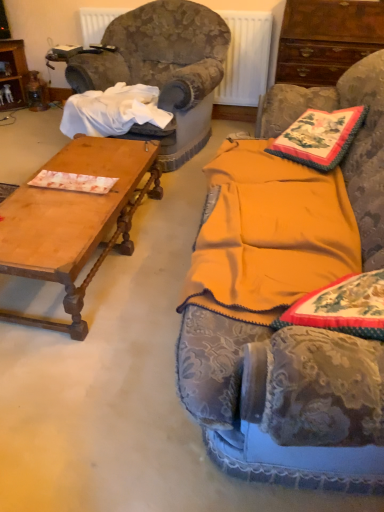
Question: Can you confirm if mahogany wood cabinet at upper right is taller than wooden polished coffee table at left?

Choices:
 (A) no
 (B) yes

Answer: (B)

Question: From a real-world perspective, is mahogany wood cabinet at upper right over wooden polished coffee table at left?

Choices:
 (A) no
 (B) yes

Answer: (B)

Question: Is mahogany wood cabinet at upper right shorter than wooden polished coffee table at left?

Choices:
 (A) no
 (B) yes

Answer: (A)

Question: Can we say mahogany wood cabinet at upper right lies outside wooden polished coffee table at left?

Choices:
 (A) yes
 (B) no

Answer: (A)

Question: Is mahogany wood cabinet at upper right positioned before wooden polished coffee table at left?

Choices:
 (A) yes
 (B) no

Answer: (B)

Question: Can you confirm if mahogany wood cabinet at upper right is positioned to the right of wooden polished coffee table at left?

Choices:
 (A) yes
 (B) no

Answer: (A)

Question: Is velvet fabric couch at center wider than wooden polished coffee table at left?

Choices:
 (A) yes
 (B) no

Answer: (A)

Question: Is velvet fabric couch at center not near wooden polished coffee table at left?

Choices:
 (A) no
 (B) yes

Answer: (B)

Question: Is velvet fabric couch at center aimed at wooden polished coffee table at left?

Choices:
 (A) yes
 (B) no

Answer: (A)

Question: From a real-world perspective, is velvet fabric couch at center on top of wooden polished coffee table at left?

Choices:
 (A) no
 (B) yes

Answer: (B)

Question: From the image's perspective, is velvet fabric couch at center located beneath wooden polished coffee table at left?

Choices:
 (A) no
 (B) yes

Answer: (A)

Question: Does velvet fabric couch at center have a smaller size compared to wooden polished coffee table at left?

Choices:
 (A) yes
 (B) no

Answer: (B)

Question: Is metallic radiator at upper center positioned far away from mahogany wood cabinet at upper right?

Choices:
 (A) no
 (B) yes

Answer: (A)